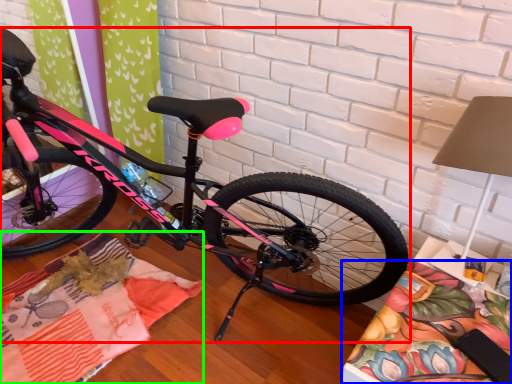
Question: Which object is the farthest from bicycle (highlighted by a red box)? Choose among these: blanket (highlighted by a blue box) or blanket (highlighted by a green box).

Choices:
 (A) blanket
 (B) blanket

Answer: (A)